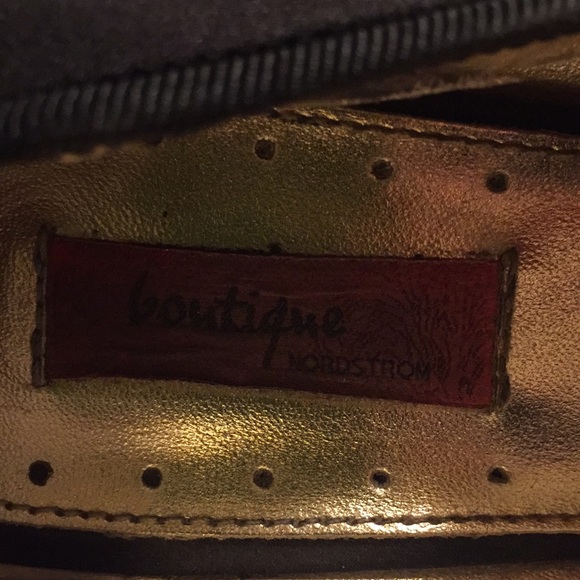
Where is `fabric`? This screenshot has height=580, width=580. fabric is located at coordinates (322, 63).